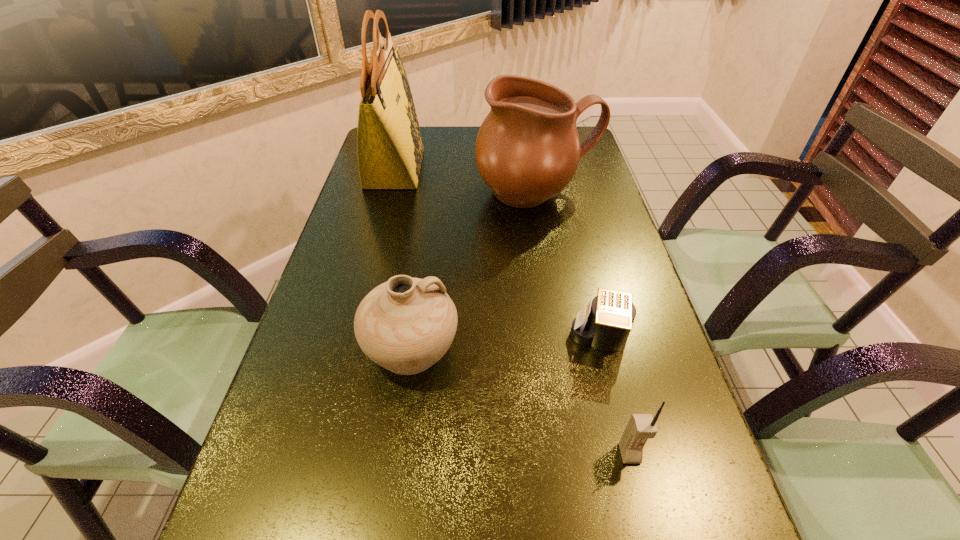
Locate an element on the screen. tote bag is located at coordinates (390, 150).

You are a GUI agent. You are given a task and a screenshot of the screen. Output one action in this format:
    pyautogui.click(x=<x>, y=<y>)
    Task: Click on the fourth shortest object
    The height and width of the screenshot is (540, 960).
    Given the screenshot: What is the action you would take?
    pyautogui.click(x=527, y=150)

Locate an element on the screen. The width and height of the screenshot is (960, 540). pottery is located at coordinates (405, 325).

The image size is (960, 540). In order to click on cellular telephone in this screenshot , I will do `click(640, 427)`.

The image size is (960, 540). Find the location of `the shortest object`. the shortest object is located at coordinates (605, 323).

Where is `free spot located on the front-facing side of the tallest object`? free spot located on the front-facing side of the tallest object is located at coordinates (536, 169).

Image resolution: width=960 pixels, height=540 pixels. Find the location of `vacant space situated at the spout of the cream pitcher`. vacant space situated at the spout of the cream pitcher is located at coordinates (550, 269).

You are a GUI agent. You are given a task and a screenshot of the screen. Output one action in this format:
    pyautogui.click(x=<x>, y=<y>)
    Task: Click on the vacant space situated 0.370m on the right of the pottery
    The height and width of the screenshot is (540, 960).
    Given the screenshot: What is the action you would take?
    pyautogui.click(x=644, y=349)

The image size is (960, 540). I want to click on free space located on the front of the cellular telephone, where the keypad is located, so click(649, 533).

This screenshot has height=540, width=960. I want to click on vacant space located 0.210m on the left of the shortest object, so click(x=468, y=337).